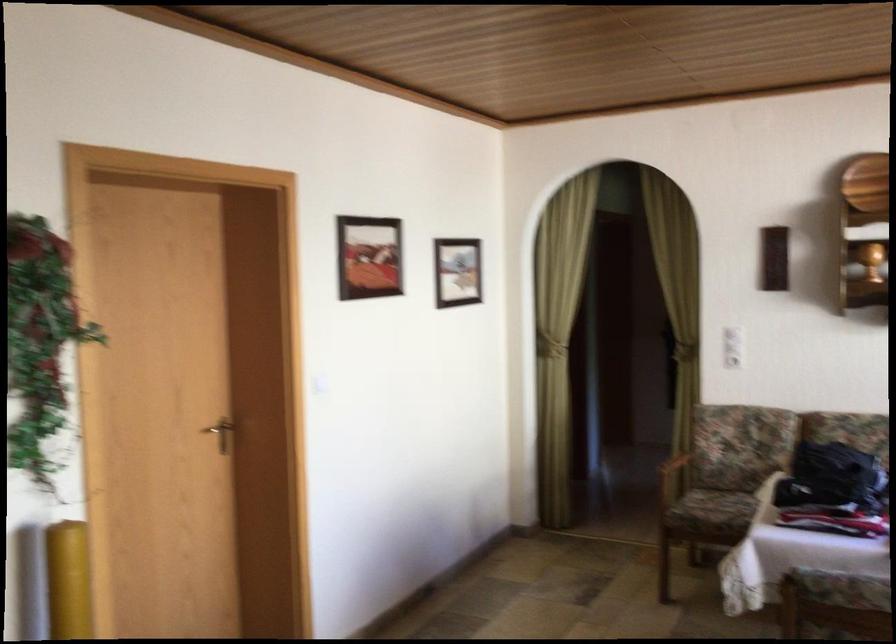
The image size is (896, 644). Describe the element at coordinates (672, 480) in the screenshot. I see `the chair armrest` at that location.